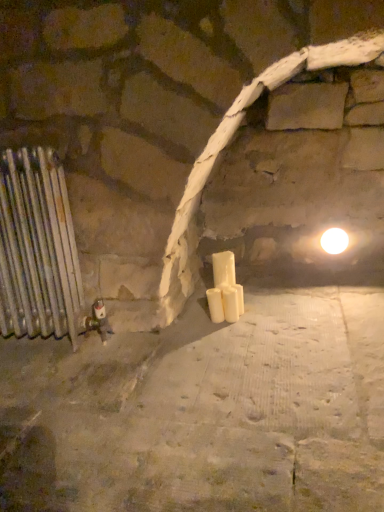
Question: Does white glossy light bulb at upper right have a lesser height compared to white matte candle at center, arranged as the second candle when viewed from the right?

Choices:
 (A) no
 (B) yes

Answer: (B)

Question: Can white matte candle at center, arranged as the second candle when viewed from the right, be found inside white glossy light bulb at upper right?

Choices:
 (A) yes
 (B) no

Answer: (B)

Question: Does white glossy light bulb at upper right turn towards white matte candle at center, arranged as the second candle when viewed from the right?

Choices:
 (A) no
 (B) yes

Answer: (A)

Question: Can you confirm if white glossy light bulb at upper right is wider than white matte candle at center, arranged as the second candle when viewed from the right?

Choices:
 (A) yes
 (B) no

Answer: (A)

Question: Considering the relative sizes of white glossy light bulb at upper right and white matte candle at center, acting as the 1th candle starting from the left, in the image provided, is white glossy light bulb at upper right bigger than white matte candle at center, acting as the 1th candle starting from the left,?

Choices:
 (A) yes
 (B) no

Answer: (A)

Question: Is white glossy light bulb at upper right in front of white matte candle at center, arranged as the second candle when viewed from the right?

Choices:
 (A) no
 (B) yes

Answer: (A)

Question: Is white matte candle at center, arranged as the second candle when viewed from the right, shorter than white glossy light bulb at upper right?

Choices:
 (A) no
 (B) yes

Answer: (A)

Question: From a real-world perspective, is white matte candle at center, arranged as the second candle when viewed from the right, located beneath white glossy light bulb at upper right?

Choices:
 (A) yes
 (B) no

Answer: (A)

Question: Is white matte candle at center, acting as the 1th candle starting from the left, positioned before white glossy light bulb at upper right?

Choices:
 (A) yes
 (B) no

Answer: (A)

Question: From the image's perspective, is white matte candle at center, acting as the 1th candle starting from the left, over white glossy light bulb at upper right?

Choices:
 (A) no
 (B) yes

Answer: (A)

Question: Considering the relative sizes of white matte candle at center, arranged as the second candle when viewed from the right, and white glossy light bulb at upper right in the image provided, is white matte candle at center, arranged as the second candle when viewed from the right, taller than white glossy light bulb at upper right?

Choices:
 (A) no
 (B) yes

Answer: (B)

Question: Is white matte candle at center, arranged as the second candle when viewed from the right, facing towards white glossy light bulb at upper right?

Choices:
 (A) yes
 (B) no

Answer: (B)

Question: Considering the relative sizes of silver metallic radiator at left and white matte candle at center, which ranks as the first candle in right-to-left order, in the image provided, is silver metallic radiator at left smaller than white matte candle at center, which ranks as the first candle in right-to-left order,?

Choices:
 (A) yes
 (B) no

Answer: (B)